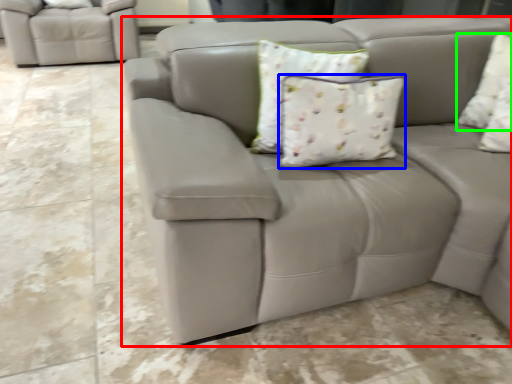
Question: Considering the real-world distances, which object is closest to studio couch (highlighted by a red box)? pillow (highlighted by a blue box) or pillow (highlighted by a green box).

Choices:
 (A) pillow
 (B) pillow

Answer: (A)